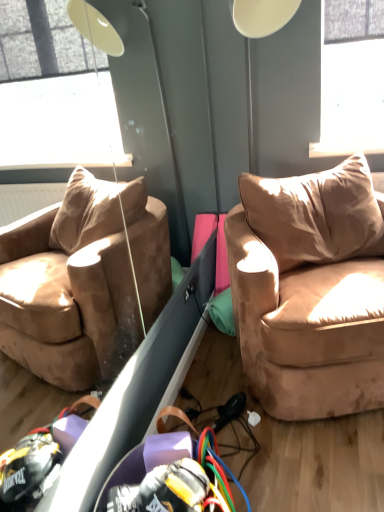
This screenshot has height=512, width=384. What are the coordinates of `suede beige couch at right` in the screenshot? It's located at (309, 291).

What do you see at coordinates (309, 291) in the screenshot?
I see `suede beige couch at right` at bounding box center [309, 291].

What is the approximate width of suede beige couch at right?

suede beige couch at right is 34.33 inches wide.

This screenshot has width=384, height=512. In order to click on suede beige couch at right in this screenshot , I will do `click(309, 291)`.